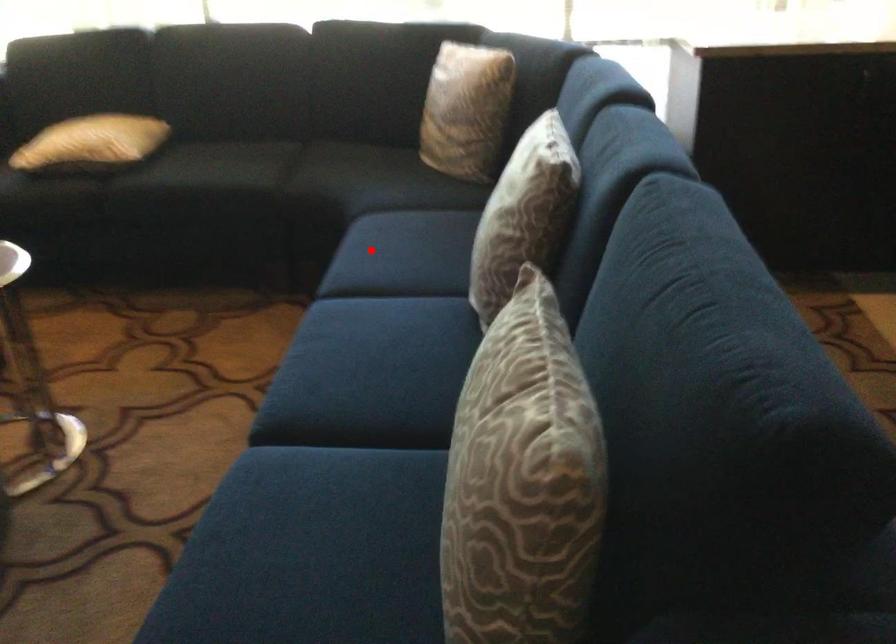
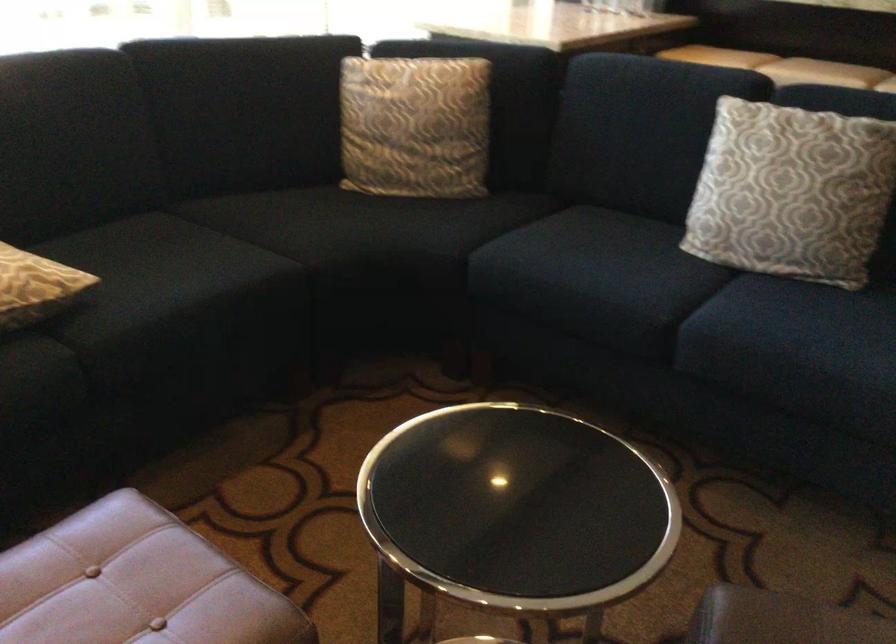
In the second image, find the point that corresponds to the highlighted location in the first image.

(590, 274)